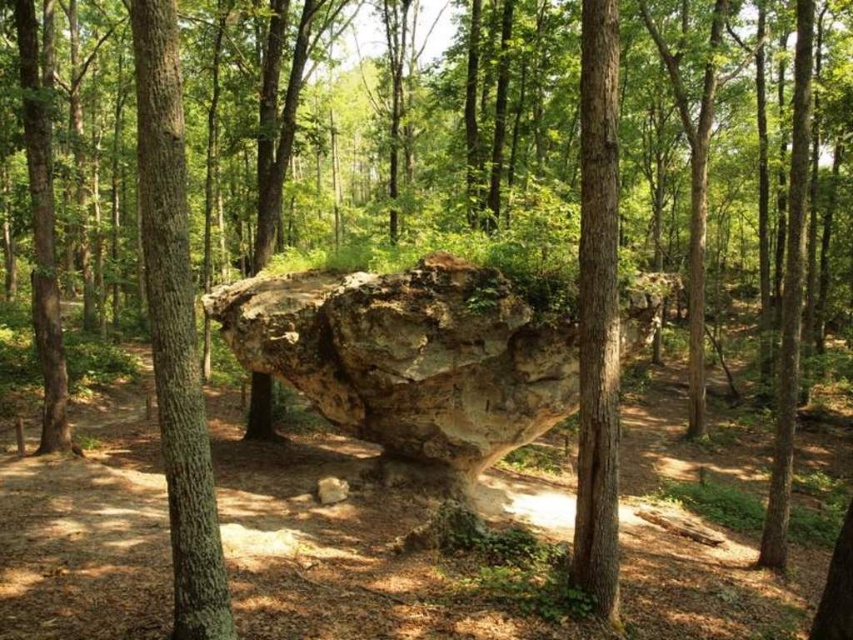
Based on the photo, who is positioned more to the left, brown rough tree trunk at center or smooth bark tree at center?

Positioned to the left is brown rough tree trunk at center.

Does point (183, 548) come behind point (583, 154)?

No, (183, 548) is in front of (583, 154).

Is point (183, 592) farther from camera compared to point (585, 538)?

No, (183, 592) is in front of (585, 538).

Identify the location of brown rough tree trunk at center. (175, 330).

Is rough textured rock at center wider than brown rough tree trunk at center?

Yes, rough textured rock at center is wider than brown rough tree trunk at center.

Does rough textured rock at center appear on the right side of brown rough tree trunk at center?

Yes, rough textured rock at center is to the right of brown rough tree trunk at center.

Where is `rough textured rock at center`? The height and width of the screenshot is (640, 853). rough textured rock at center is located at coordinates tap(412, 356).

Find the location of a particular element. The image size is (853, 640). rough textured rock at center is located at coordinates (412, 356).

Which is behind, point (329, 332) or point (581, 276)?

Positioned behind is point (329, 332).

Can you confirm if rough textured rock at center is shorter than smooth bark tree at center?

Incorrect, rough textured rock at center's height does not fall short of smooth bark tree at center's.

Where is `rough textured rock at center`? rough textured rock at center is located at coordinates (412, 356).